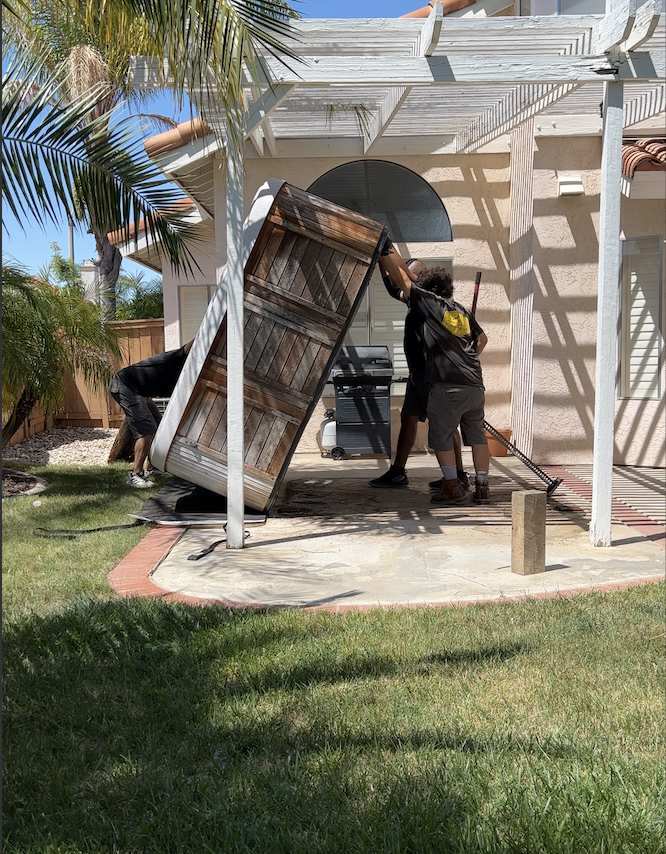
This screenshot has height=854, width=666. Find the location of `joist`. joist is located at coordinates (387, 104), (533, 101), (268, 108), (643, 97).